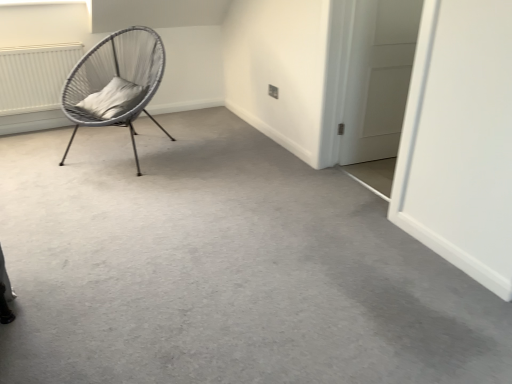
I want to click on vacant area situated to the left side of woven grey chair at left, so pos(49,149).